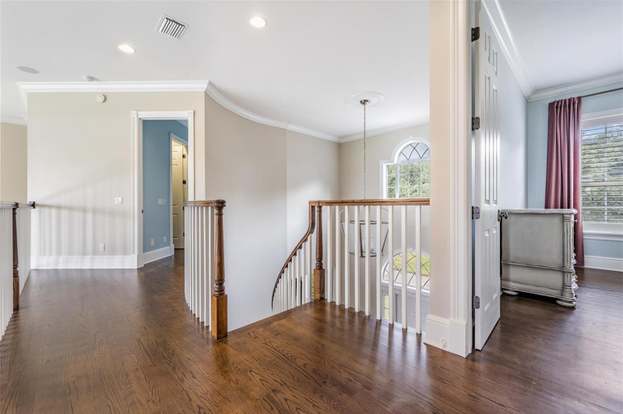
Find the location of a particular element. This screenshot has height=414, width=623. hanging light is located at coordinates (364, 178).